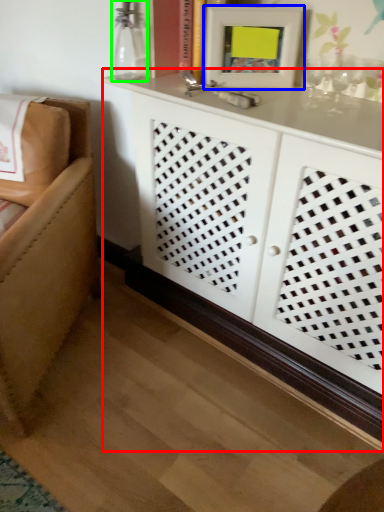
Question: Which object is positioned farthest from cabinetry (highlighted by a red box)? Select from picture frame (highlighted by a blue box) and glass vase (highlighted by a green box).

Choices:
 (A) picture frame
 (B) glass vase

Answer: (B)